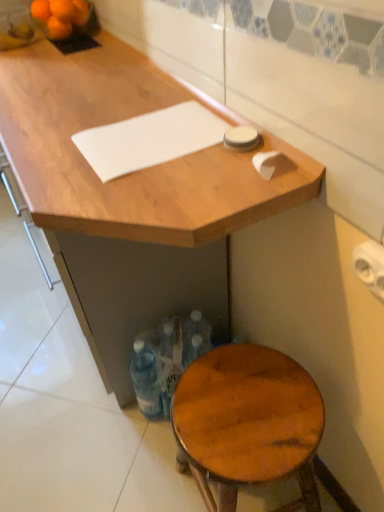
Locate an element on the screen. The image size is (384, 512). free region on the left part of translucent plastic bottles at lower center is located at coordinates (111, 422).